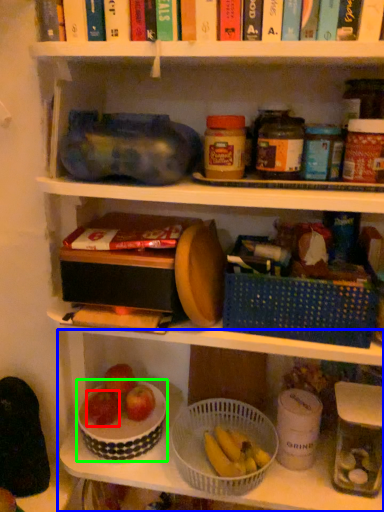
Question: Estimate the real-world distances between objects in this image. Which object is closer to apple (highlighted by a red box), shelf (highlighted by a blue box) or bowl (highlighted by a green box)?

Choices:
 (A) shelf
 (B) bowl

Answer: (B)